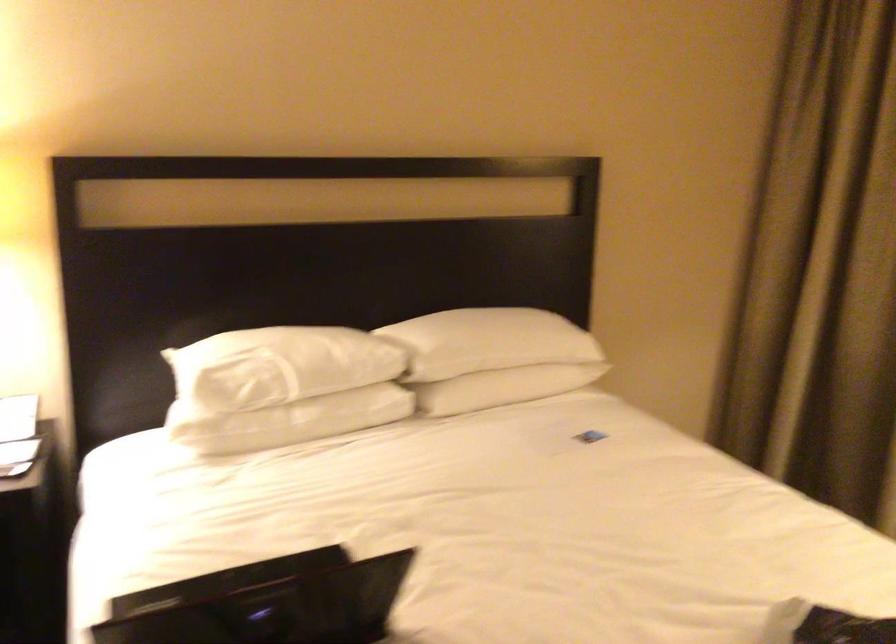
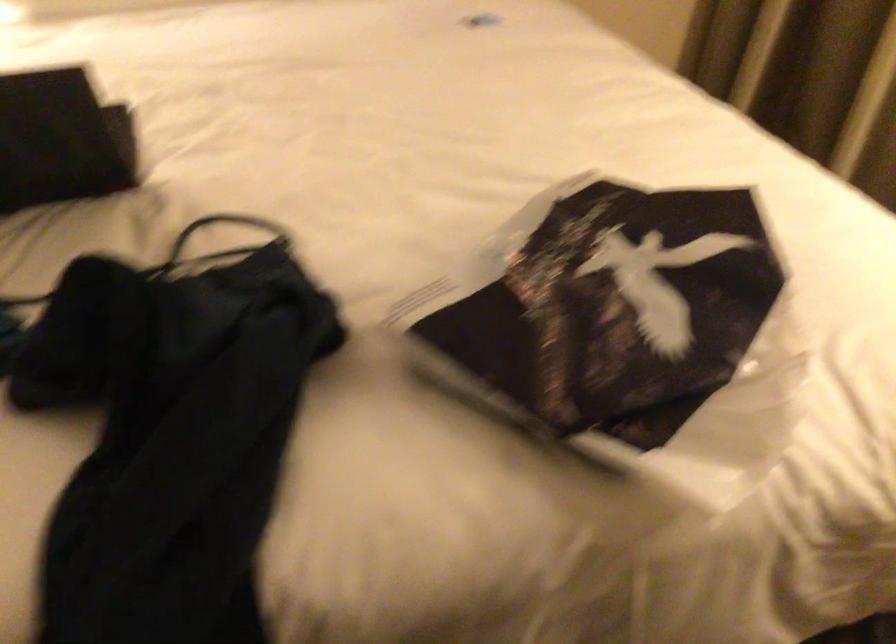
In a continuous first-person perspective shot, in which direction is the camera moving?

The movement direction of the cameraman is right, forward.